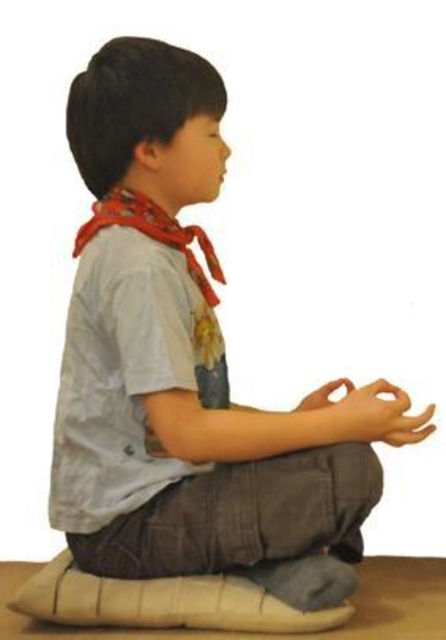
From the picture: How distant is red cotton scarf at upper left from smooth tan hand at lower right?

A distance of 48.88 centimeters exists between red cotton scarf at upper left and smooth tan hand at lower right.

Who is lower down, red cotton scarf at upper left or smooth tan hand at lower right?

smooth tan hand at lower right is below.

Who is more forward, [185,244] or [388,419]?

Point [388,419] is more forward.

The width and height of the screenshot is (446, 640). Find the location of `red cotton scarf at upper left`. red cotton scarf at upper left is located at coordinates (152, 234).